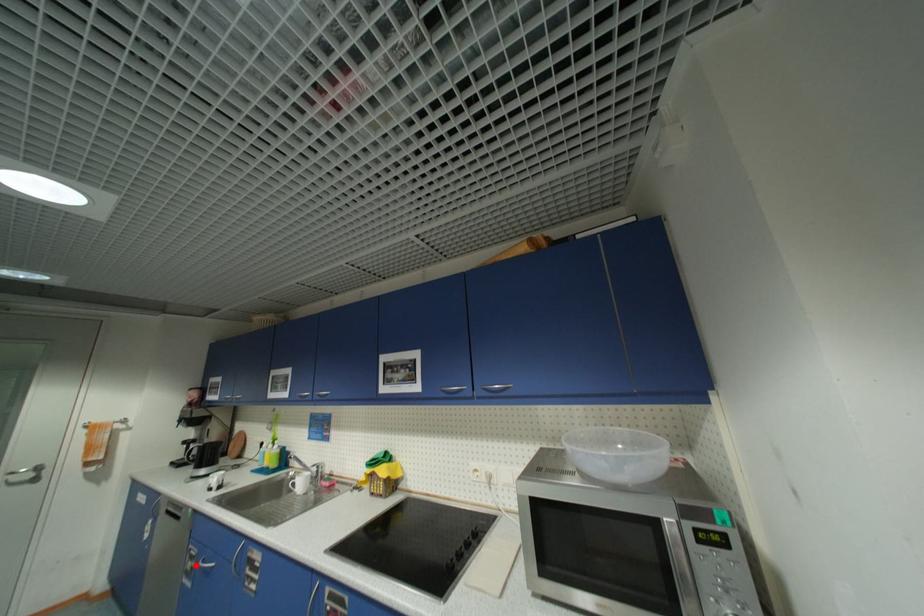
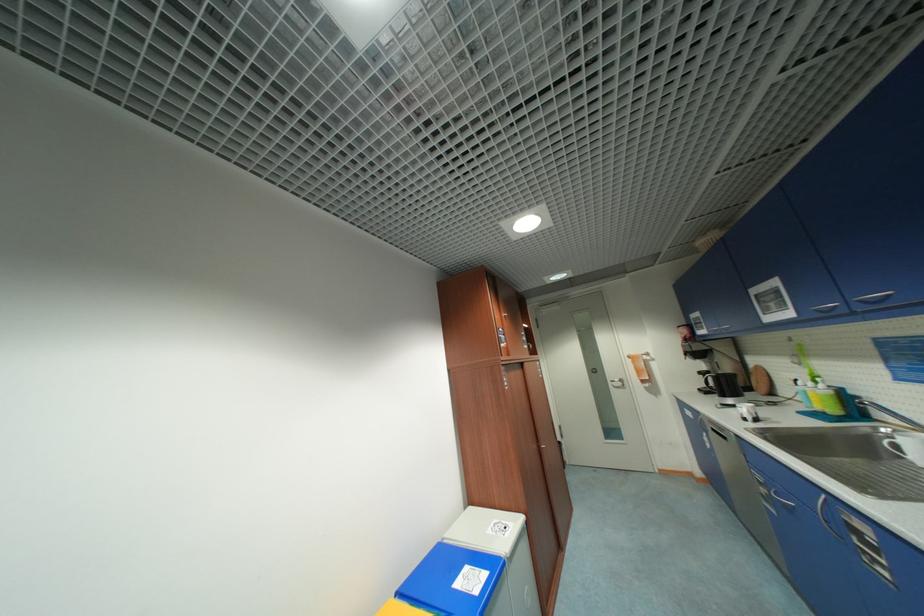
Question: I am providing you with two images of the same scene from different viewpoints. A red point is marked on the first image. Can you still see the location of the red point in image 2?

Choices:
 (A) Yes
 (B) No

Answer: (A)